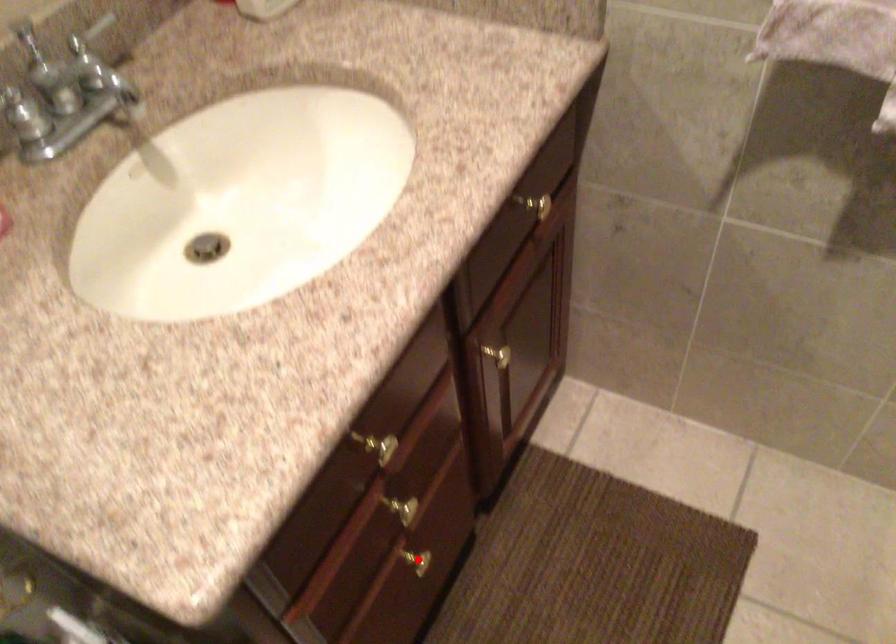
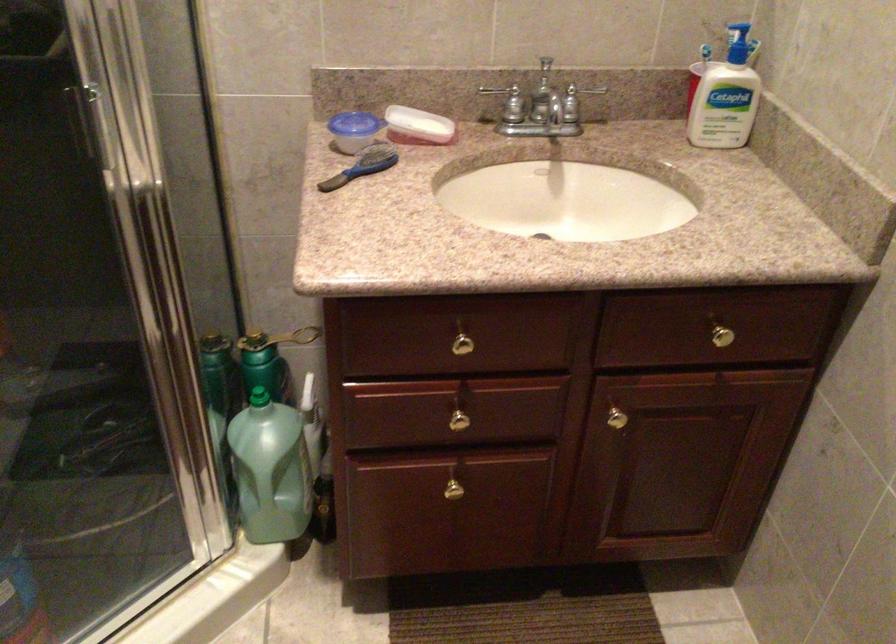
The point at the highlighted location is marked in the first image. Where is the corresponding point in the second image?

(455, 488)